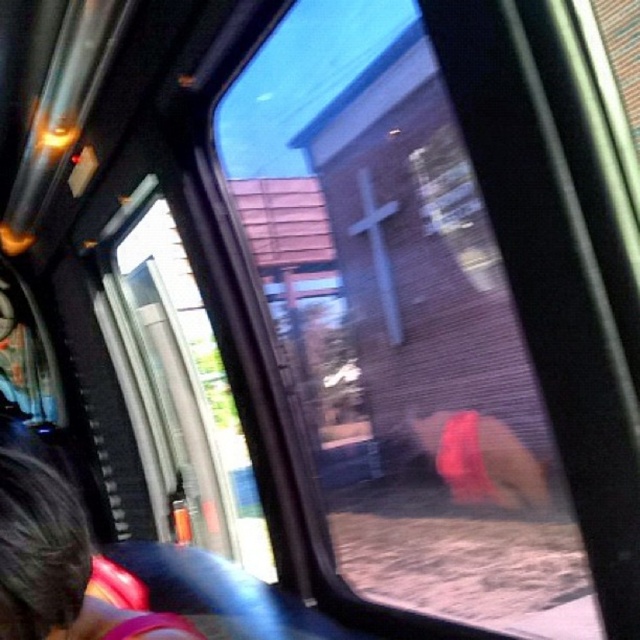
From the picture: Does transparent glass window at center appear on the right side of dark brown hair at lower left?

No, transparent glass window at center is not to the right of dark brown hair at lower left.

Describe the element at coordinates (188, 387) in the screenshot. Image resolution: width=640 pixels, height=640 pixels. I see `transparent glass window at center` at that location.

In order to click on transparent glass window at center in this screenshot , I will do `click(188, 387)`.